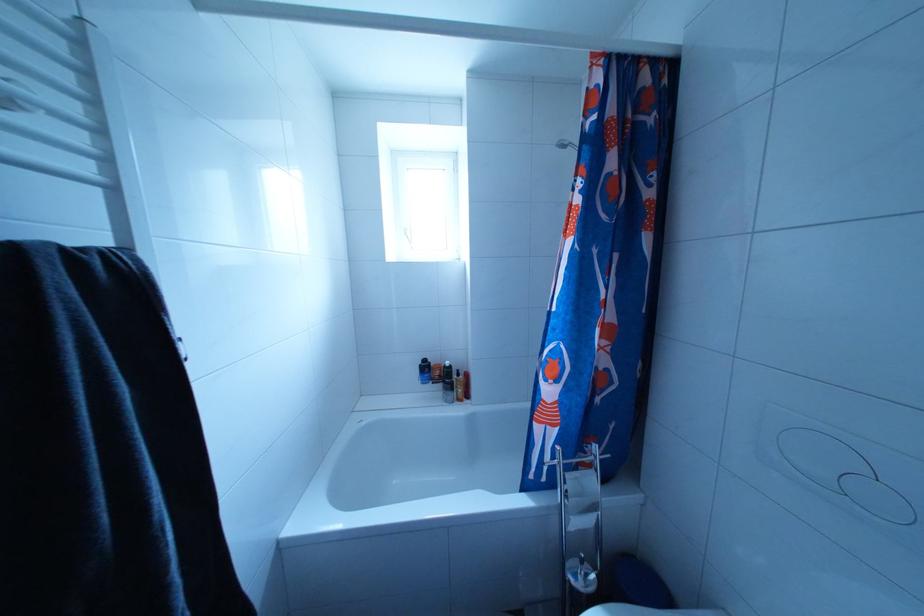
Where is `large flush button`? The width and height of the screenshot is (924, 616). large flush button is located at coordinates (844, 464).